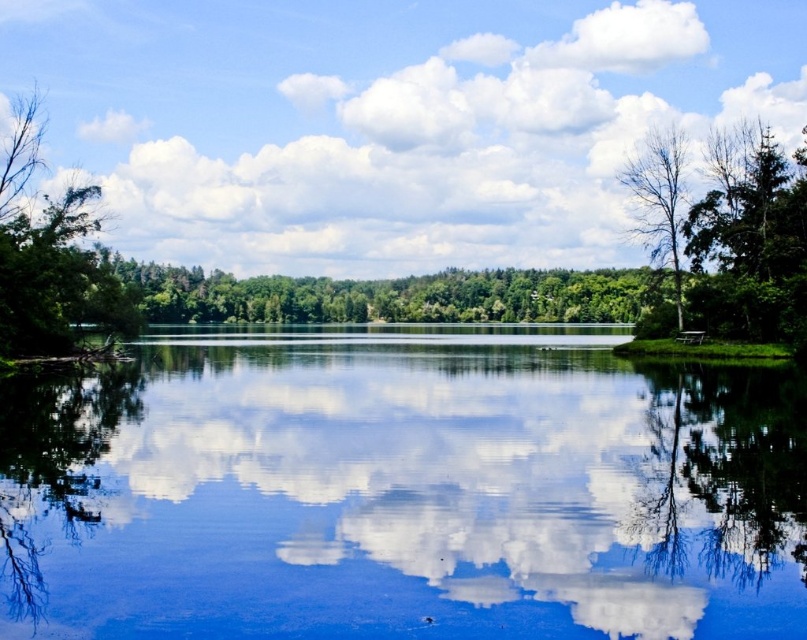
Question: Can you confirm if green leafy tree at right is thinner than bare wood tree at right?

Choices:
 (A) yes
 (B) no

Answer: (A)

Question: Which point appears farthest from the camera in this image?

Choices:
 (A) (741, 449)
 (B) (713, 234)

Answer: (B)

Question: Does transparent glass water at center appear over green leafy tree at right?

Choices:
 (A) no
 (B) yes

Answer: (A)

Question: Is transparent glass water at center below bare wood tree at right?

Choices:
 (A) yes
 (B) no

Answer: (A)

Question: Which point is closer to the camera?

Choices:
 (A) bare wood tree at right
 (B) green leafy tree at right
 (C) green leafy tree at left
 (D) green leafy forest at center

Answer: (C)

Question: Estimate the real-world distances between objects in this image. Which object is closer to the transparent glass tree at right?

Choices:
 (A) transparent glass water at center
 (B) green leafy tree at right

Answer: (A)